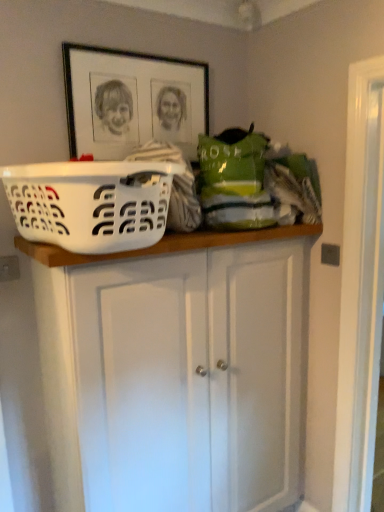
Image resolution: width=384 pixels, height=512 pixels. I want to click on black matte picture frame at upper center, so click(132, 101).

What is the approximate width of white painted wood cabinet at upper center?

white painted wood cabinet at upper center is 3.06 inches in width.

The height and width of the screenshot is (512, 384). What are the coordinates of `white painted wood cabinet at upper center` in the screenshot? It's located at (181, 368).

In order to face white plastic laundry basket at upper center, should I rotate leftwards or rightwards?

You should rotate left by 10.954 degrees.

Find the location of a particular element. This screenshot has width=384, height=512. black matte picture frame at upper center is located at coordinates [x=132, y=101].

Measure the distance from white painted wood cabinet at upper center to white plastic laundry basket at upper center.

They are 18.04 inches apart.

Considering the relative sizes of white painted wood cabinet at upper center and white plastic laundry basket at upper center in the image provided, is white painted wood cabinet at upper center wider than white plastic laundry basket at upper center?

Incorrect, the width of white painted wood cabinet at upper center does not surpass that of white plastic laundry basket at upper center.

The image size is (384, 512). What are the coordinates of `cabinetry below the white plastic laundry basket at upper center (from a real-world perspective)` in the screenshot? It's located at (181, 368).

Relative to white plastic laundry basket at upper center, is white painted wood cabinet at upper center in front or behind?

In the image, white painted wood cabinet at upper center appears behind white plastic laundry basket at upper center.

Does white plastic laundry basket at upper center have a greater width compared to white painted wood cabinet at upper center?

Correct, the width of white plastic laundry basket at upper center exceeds that of white painted wood cabinet at upper center.

Measure the distance from white plastic laundry basket at upper center to white painted wood cabinet at upper center.

white plastic laundry basket at upper center is 18.04 inches from white painted wood cabinet at upper center.

Based on the photo, which is correct: white plastic laundry basket at upper center is inside white painted wood cabinet at upper center, or outside of it?

white plastic laundry basket at upper center is not enclosed by white painted wood cabinet at upper center.

From the image's perspective, is white plastic laundry basket at upper center above or below white painted wood cabinet at upper center?

From the image's perspective, white plastic laundry basket at upper center appears above white painted wood cabinet at upper center.

Does black matte picture frame at upper center have a lesser width compared to white plastic laundry basket at upper center?

Indeed, black matte picture frame at upper center has a lesser width compared to white plastic laundry basket at upper center.

Is black matte picture frame at upper center directly adjacent to white plastic laundry basket at upper center?

black matte picture frame at upper center is not next to white plastic laundry basket at upper center, and they're not touching.

From the image's perspective, between black matte picture frame at upper center and white plastic laundry basket at upper center, which one is located above?

black matte picture frame at upper center, from the image's perspective.

Is black matte picture frame at upper center inside or outside of white plastic laundry basket at upper center?

black matte picture frame at upper center lies outside white plastic laundry basket at upper center.

From the image's perspective, does white plastic laundry basket at upper center appear higher than black matte picture frame at upper center?

Incorrect, from the image's perspective, white plastic laundry basket at upper center is lower than black matte picture frame at upper center.

Which is more to the right, white plastic laundry basket at upper center or black matte picture frame at upper center?

From the viewer's perspective, black matte picture frame at upper center appears more on the right side.

Consider the image. Which point is more forward, (223, 475) or (115, 146)?

The point (115, 146) is closer to the camera.

Is white painted wood cabinet at upper center inside the boundaries of black matte picture frame at upper center, or outside?

white painted wood cabinet at upper center is located beyond the bounds of black matte picture frame at upper center.

Based on the photo, are white painted wood cabinet at upper center and black matte picture frame at upper center beside each other?

No, white painted wood cabinet at upper center is not with black matte picture frame at upper center.

Considering the sizes of white painted wood cabinet at upper center and black matte picture frame at upper center in the image, is white painted wood cabinet at upper center wider or thinner than black matte picture frame at upper center?

Considering their sizes, white painted wood cabinet at upper center looks broader than black matte picture frame at upper center.

Between black matte picture frame at upper center and white painted wood cabinet at upper center, which one has larger size?

Bigger between the two is white painted wood cabinet at upper center.

Can you tell me how much black matte picture frame at upper center and white painted wood cabinet at upper center differ in facing direction?

0.00715 degrees separate the facing orientations of black matte picture frame at upper center and white painted wood cabinet at upper center.

Which is more to the left, black matte picture frame at upper center or white painted wood cabinet at upper center?

black matte picture frame at upper center is more to the left.

Locate an element on the screen. The image size is (384, 512). basket that appears on the left of white painted wood cabinet at upper center is located at coordinates (91, 203).

The image size is (384, 512). I want to click on basket in front of the white painted wood cabinet at upper center, so click(91, 203).

Estimate the real-world distances between objects in this image. Which object is further from white plastic laundry basket at upper center, black matte picture frame at upper center or white painted wood cabinet at upper center?

black matte picture frame at upper center is further to white plastic laundry basket at upper center.

Based on their spatial positions, is white painted wood cabinet at upper center or white plastic laundry basket at upper center closer to black matte picture frame at upper center?

Among the two, white plastic laundry basket at upper center is located nearer to black matte picture frame at upper center.

From the image, which object appears to be farther from white painted wood cabinet at upper center, white plastic laundry basket at upper center or black matte picture frame at upper center?

black matte picture frame at upper center is further to white painted wood cabinet at upper center.

Based on their spatial positions, is white plastic laundry basket at upper center or white painted wood cabinet at upper center further from black matte picture frame at upper center?

Among the two, white painted wood cabinet at upper center is located further to black matte picture frame at upper center.

Consider the image. When comparing their distances from white plastic laundry basket at upper center, does white painted wood cabinet at upper center or black matte picture frame at upper center seem further?

The object further to white plastic laundry basket at upper center is black matte picture frame at upper center.

Looking at the image, which one is located further to white painted wood cabinet at upper center, black matte picture frame at upper center or white plastic laundry basket at upper center?

black matte picture frame at upper center is positioned further to the anchor white painted wood cabinet at upper center.

Identify the location of basket between black matte picture frame at upper center and white painted wood cabinet at upper center in the up-down direction. The image size is (384, 512). (91, 203).